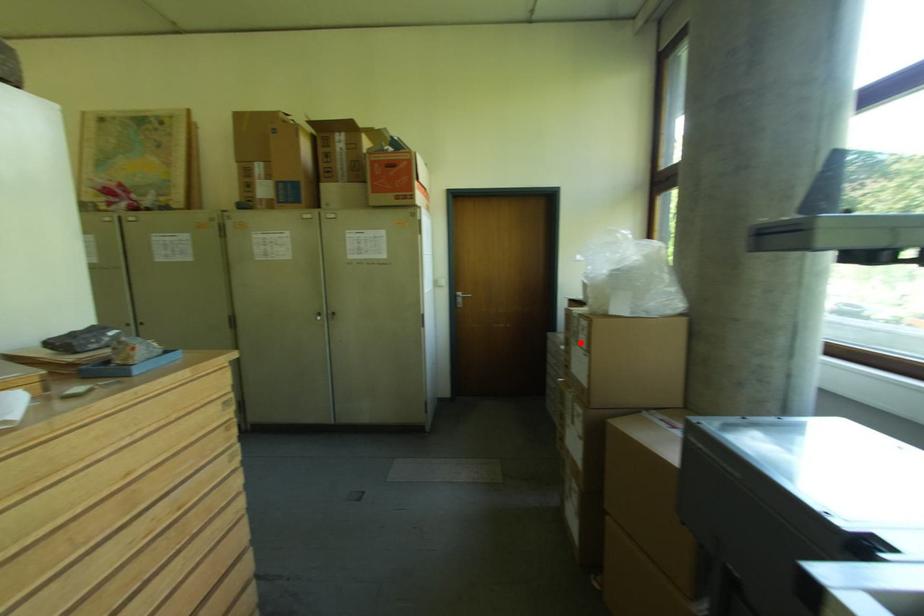
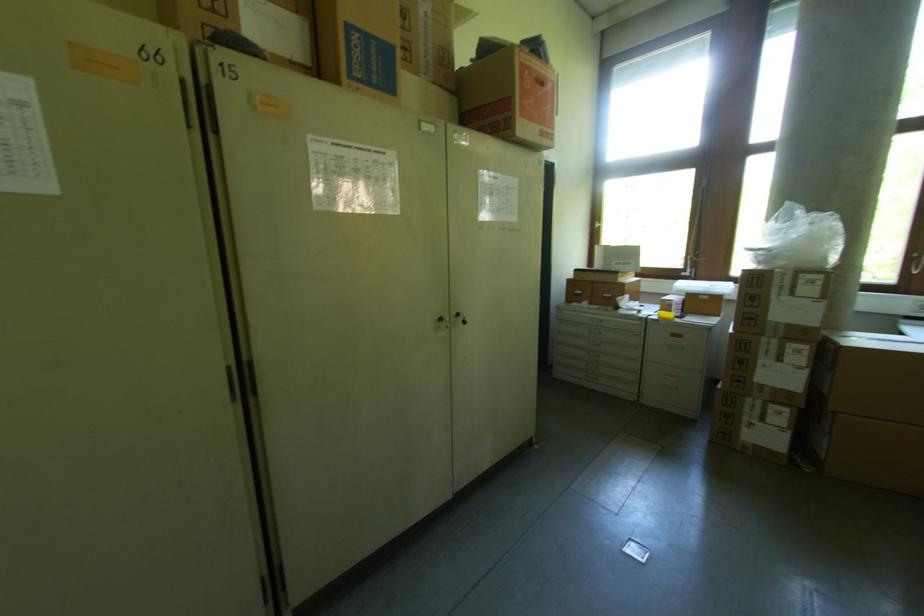
Locate, in the second image, the point that corresponds to the highlighted location in the first image.

(795, 294)